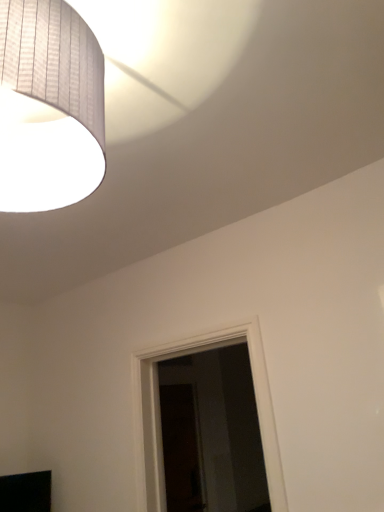
Question: Can you confirm if white paper lampshade at upper left is positioned to the right of black matte tv at lower left?

Choices:
 (A) yes
 (B) no

Answer: (A)

Question: Can we say white paper lampshade at upper left lies outside black matte tv at lower left?

Choices:
 (A) yes
 (B) no

Answer: (A)

Question: Are white paper lampshade at upper left and black matte tv at lower left located far from each other?

Choices:
 (A) no
 (B) yes

Answer: (B)

Question: Considering the relative sizes of white paper lampshade at upper left and black matte tv at lower left in the image provided, is white paper lampshade at upper left taller than black matte tv at lower left?

Choices:
 (A) yes
 (B) no

Answer: (A)

Question: Is white paper lampshade at upper left at the left side of black matte tv at lower left?

Choices:
 (A) yes
 (B) no

Answer: (B)

Question: Is white paper lampshade at upper left positioned behind black matte tv at lower left?

Choices:
 (A) yes
 (B) no

Answer: (B)

Question: Is black matte tv at lower left to the left of white paper lampshade at upper left from the viewer's perspective?

Choices:
 (A) no
 (B) yes

Answer: (B)

Question: From a real-world perspective, is black matte tv at lower left positioned under white paper lampshade at upper left based on gravity?

Choices:
 (A) no
 (B) yes

Answer: (B)

Question: Is black matte tv at lower left completely or partially outside of white paper lampshade at upper left?

Choices:
 (A) yes
 (B) no

Answer: (A)

Question: From a real-world perspective, is black matte tv at lower left on top of white paper lampshade at upper left?

Choices:
 (A) no
 (B) yes

Answer: (A)

Question: Is black matte tv at lower left looking in the opposite direction of white paper lampshade at upper left?

Choices:
 (A) no
 (B) yes

Answer: (A)

Question: Considering the relative sizes of black matte tv at lower left and white paper lampshade at upper left in the image provided, is black matte tv at lower left shorter than white paper lampshade at upper left?

Choices:
 (A) no
 (B) yes

Answer: (B)

Question: From a real-world perspective, relative to black matte tv at lower left, is white paper lampshade at upper left vertically above or below?

Choices:
 (A) above
 (B) below

Answer: (A)